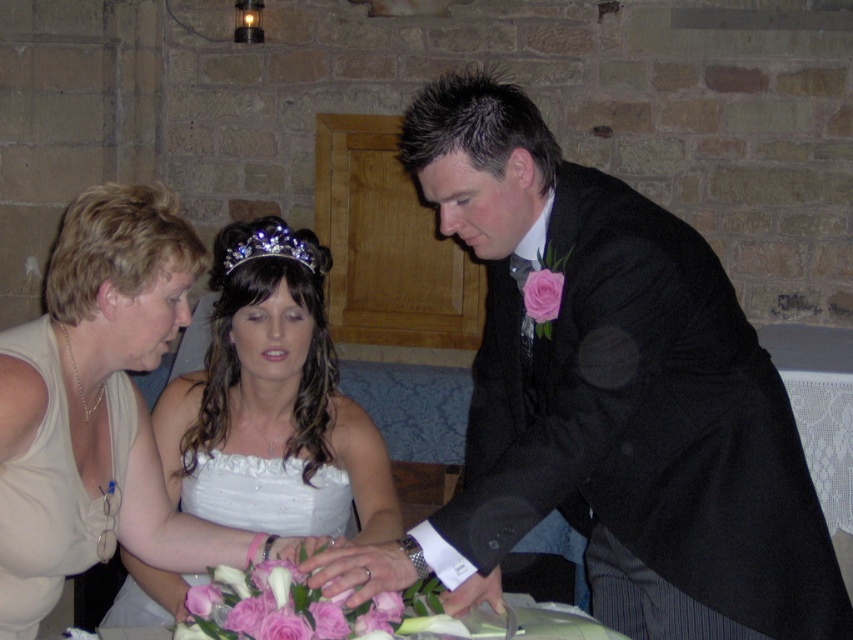
In the wedding scene described, there is a point marked at coordinates [605,401]. Which object from the scene does this point correspond to?

The point at coordinates [605,401] corresponds to the matte black suit at center.

You are a photographer at the wedding and need to adjust the lighting to highlight both the white satin dress at center and the white satin wedding dress at center. Since they are both white, you need to position the lights based on their distance from you. Which dress should you focus the light on first to ensure it appears closer in the photo?

The white satin dress at center is closer to the viewer than the white satin wedding dress at center, so you should focus the light on the white satin dress at center first to make it appear closer in the photo.

You are a photographer at the wedding and need to adjust the lighting so that both the white satin dress at center and the white satin wedding dress at center are evenly illuminated. Since the two dresses are 3.52 inches apart, how far apart should you position the two light sources to ensure even lighting?

The two dresses are 3.52 inches apart, so the light sources should also be placed 3.52 inches apart to ensure even illumination between them.